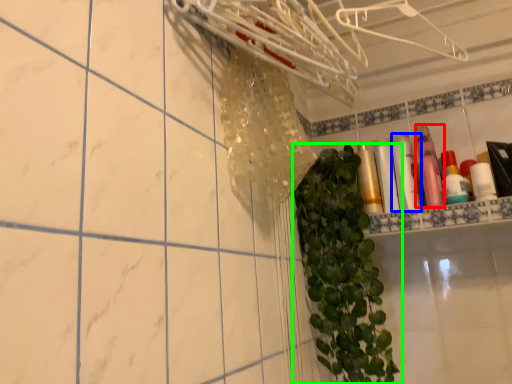
Question: Which is farther away from toiletry (highlighted by a red box)? toiletry (highlighted by a blue box) or houseplant (highlighted by a green box)?

Choices:
 (A) toiletry
 (B) houseplant

Answer: (B)